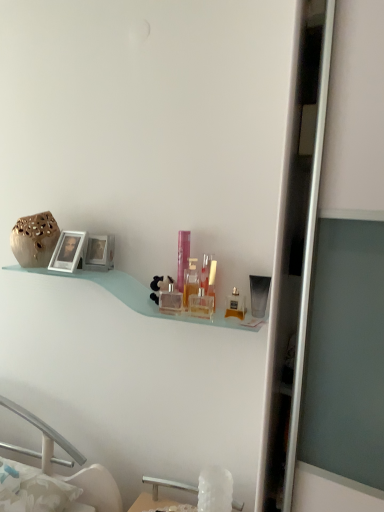
Identify the location of silver metallic picture frame at left, which is the second picture frame from right to left. Image resolution: width=384 pixels, height=512 pixels. (68, 251).

What is the approximate height of white glossy table at lower center?

It is 2.82 inches.

Locate an element on the screen. The width and height of the screenshot is (384, 512). silver metallic picture frame at left, which is the second picture frame from right to left is located at coordinates (68, 251).

From a real-world perspective, is white fabric pillow at lower left positioned under pink glass perfume bottle at center, which appears as the 2th toiletry when viewed from the left, based on gravity?

Yes, from a real-world perspective, white fabric pillow at lower left is under pink glass perfume bottle at center, which appears as the 2th toiletry when viewed from the left.

Does white fabric pillow at lower left have a lesser width compared to pink glass perfume bottle at center, marked as the 7th toiletry in a right-to-left arrangement?

No.

Where is `pillow below the pink glass perfume bottle at center, marked as the 7th toiletry in a right-to-left arrangement (from a real-world perspective)`? The height and width of the screenshot is (512, 384). pillow below the pink glass perfume bottle at center, marked as the 7th toiletry in a right-to-left arrangement (from a real-world perspective) is located at coordinates (34, 490).

Which object is positioned more to the right, white fabric pillow at lower left or pink glass perfume bottle at center, which appears as the 2th toiletry when viewed from the left?

Positioned to the right is pink glass perfume bottle at center, which appears as the 2th toiletry when viewed from the left.

From a real-world perspective, which object stands above the other?

metallic silver picture frame at upper left, the first picture frame from the right.

Which is in front, point (207, 304) or point (97, 239)?

The point (207, 304) is in front.

Which object is further away from the camera, clear glass perfume bottle at center, the fourth toiletry in the left-to-right sequence, or metallic silver picture frame at upper left, which is the 2th picture frame from left to right?

Positioned behind is metallic silver picture frame at upper left, which is the 2th picture frame from left to right.

Based on the photo, from a real-world perspective, relative to pink glass perfume bottle at center, which appears as the 2th toiletry when viewed from the left, is white crystal sink at lower center vertically above or below?

white crystal sink at lower center is below pink glass perfume bottle at center, which appears as the 2th toiletry when viewed from the left.

Is point (243, 505) less distant than point (185, 248)?

No, (243, 505) is behind (185, 248).

Between white crystal sink at lower center and pink glass perfume bottle at center, marked as the 7th toiletry in a right-to-left arrangement, which one has more height?

With more height is pink glass perfume bottle at center, marked as the 7th toiletry in a right-to-left arrangement.

Which object is positioned more to the left, matte gold perfume at center, which appears as the 2th toiletry when viewed from the right, or pink glass perfume bottle at center, marked as the 7th toiletry in a right-to-left arrangement?

Positioned to the left is pink glass perfume bottle at center, marked as the 7th toiletry in a right-to-left arrangement.

From a real-world perspective, is matte gold perfume at center, which appears as the 2th toiletry when viewed from the right, physically above pink glass perfume bottle at center, marked as the 7th toiletry in a right-to-left arrangement?

No, from a real-world perspective, matte gold perfume at center, which appears as the 2th toiletry when viewed from the right, is not above pink glass perfume bottle at center, marked as the 7th toiletry in a right-to-left arrangement.

Do you think matte gold perfume at center, which appears as the 2th toiletry when viewed from the right, is within pink glass perfume bottle at center, marked as the 7th toiletry in a right-to-left arrangement, or outside of it?

matte gold perfume at center, which appears as the 2th toiletry when viewed from the right, is not inside pink glass perfume bottle at center, marked as the 7th toiletry in a right-to-left arrangement, it's outside.

Could you measure the distance between matte gold perfume at center, placed as the 7th toiletry when sorted from left to right, and pink glass perfume bottle at center, marked as the 7th toiletry in a right-to-left arrangement?

matte gold perfume at center, placed as the 7th toiletry when sorted from left to right, is 8.44 inches away from pink glass perfume bottle at center, marked as the 7th toiletry in a right-to-left arrangement.

Can you confirm if metallic silver picture frame at upper left, the first picture frame from the right, is shorter than clear plastic bottle at center, the 4th toiletry when ordered from right to left?

Correct, metallic silver picture frame at upper left, the first picture frame from the right, is not as tall as clear plastic bottle at center, the 4th toiletry when ordered from right to left.

Considering the positions of points (104, 259) and (210, 258), is point (104, 259) farther from camera compared to point (210, 258)?

That is True.

Find the location of a particular element. The width and height of the screenshot is (384, 512). the 2nd picture frame behind the clear plastic bottle at center, the 5th toiletry from the left is located at coordinates (99, 253).

Based on the photo, does translucent glass perfume bottle at center, the 3th toiletry in the left-to-right sequence, appear on the left side of white fabric pillow at lower left?

No.

Considering the sizes of translucent glass perfume bottle at center, which is the 6th toiletry from right to left, and white fabric pillow at lower left in the image, is translucent glass perfume bottle at center, which is the 6th toiletry from right to left, taller or shorter than white fabric pillow at lower left?

Considering their sizes, translucent glass perfume bottle at center, which is the 6th toiletry from right to left, has more height than white fabric pillow at lower left.

Does translucent glass perfume bottle at center, the 3th toiletry in the left-to-right sequence, have a smaller size compared to white fabric pillow at lower left?

Correct, translucent glass perfume bottle at center, the 3th toiletry in the left-to-right sequence, occupies less space than white fabric pillow at lower left.

How many degrees apart are the facing directions of white crystal sink at lower center and silver metallic picture frame at left, acting as the first picture frame starting from the left?

white crystal sink at lower center and silver metallic picture frame at left, acting as the first picture frame starting from the left, are facing 1.32 degrees away from each other.

From the picture: Which object is closer to the camera, white crystal sink at lower center or silver metallic picture frame at left, acting as the first picture frame starting from the left?

white crystal sink at lower center is in front.

Can you confirm if white crystal sink at lower center is positioned to the left of silver metallic picture frame at left, which is the second picture frame from right to left?

No, white crystal sink at lower center is not to the left of silver metallic picture frame at left, which is the second picture frame from right to left.

From a real-world perspective, is white crystal sink at lower center physically above silver metallic picture frame at left, which is the second picture frame from right to left?

No, from a real-world perspective, white crystal sink at lower center is not on top of silver metallic picture frame at left, which is the second picture frame from right to left.

This screenshot has height=512, width=384. Find the location of `toiletry that is the 8th one when counting upward from the white fabric pillow at lower left (from the image's perspective)`. toiletry that is the 8th one when counting upward from the white fabric pillow at lower left (from the image's perspective) is located at coordinates (182, 257).

Identify the location of the 2nd picture frame behind the clear glass perfume bottle at center, the fourth toiletry in the left-to-right sequence. click(x=99, y=253).

Consider the image. Which object lies further to the anchor point silver metallic picture frame at left, acting as the first picture frame starting from the left, white glossy table at lower center or pink glass perfume bottle at center, marked as the 7th toiletry in a right-to-left arrangement?

Based on the image, white glossy table at lower center appears to be further to silver metallic picture frame at left, acting as the first picture frame starting from the left.

Looking at the image, which one is located closer to satin black tube at upper right, arranged as the eighth toiletry when viewed from the left, clear plastic bottle at center, the 4th toiletry when ordered from right to left, or white glossy table at lower center?

clear plastic bottle at center, the 4th toiletry when ordered from right to left, is closer to satin black tube at upper right, arranged as the eighth toiletry when viewed from the left.

Looking at the image, which one is located further to white crystal sink at lower center, white glossy table at lower center or clear plastic bottle at center, the 4th toiletry when ordered from right to left?

Among the two, clear plastic bottle at center, the 4th toiletry when ordered from right to left, is located further to white crystal sink at lower center.

Estimate the real-world distances between objects in this image. Which object is further from clear glass perfume bottle at center, the fourth toiletry in the left-to-right sequence, translucent glass perfume bottle at center, which is the 6th toiletry from right to left, or white glossy table at lower center?

The object further to clear glass perfume bottle at center, the fourth toiletry in the left-to-right sequence, is white glossy table at lower center.

Estimate the real-world distances between objects in this image. Which object is further from metallic silver picture frame at upper left, which is the 2th picture frame from left to right, satin black tube at upper right, arranged as the eighth toiletry when viewed from the left, or clear plastic bottle at center, the 4th toiletry when ordered from right to left?

satin black tube at upper right, arranged as the eighth toiletry when viewed from the left, is positioned further to the anchor metallic silver picture frame at upper left, which is the 2th picture frame from left to right.

When comparing their distances from white crystal sink at lower center, does clear glass perfume bottle at center, positioned as the fifth toiletry in right-to-left order, or pink glass perfume bottle at center, marked as the 7th toiletry in a right-to-left arrangement, seem further?

Among the two, pink glass perfume bottle at center, marked as the 7th toiletry in a right-to-left arrangement, is located further to white crystal sink at lower center.

When comparing their distances from satin black tube at upper right, arranged as the eighth toiletry when viewed from the left, does clear glass perfume bottle at center, which is the 1th toiletry from left to right, or white crystal sink at lower center seem closer?

Among the two, clear glass perfume bottle at center, which is the 1th toiletry from left to right, is located nearer to satin black tube at upper right, arranged as the eighth toiletry when viewed from the left.

Which object lies further to the anchor point white fabric pillow at lower left, translucent glass perfume bottle at center, which is the 6th toiletry from right to left, or clear plastic bottle at center, the 4th toiletry when ordered from right to left?

Among the two, clear plastic bottle at center, the 4th toiletry when ordered from right to left, is located further to white fabric pillow at lower left.

Locate an element on the screen. The image size is (384, 512). sink that lies between satin black tube at upper right, arranged as the eighth toiletry when viewed from the left, and white glossy table at lower center from top to bottom is located at coordinates (168, 485).

Locate an element on the screen. The width and height of the screenshot is (384, 512). sink that lies between silver metallic picture frame at left, which is the second picture frame from right to left, and white glossy table at lower center from top to bottom is located at coordinates (168, 485).

Locate an element on the screen. The height and width of the screenshot is (512, 384). picture frame between silver metallic picture frame at left, acting as the first picture frame starting from the left, and matte gold perfume at center, placed as the 7th toiletry when sorted from left to right, in the horizontal direction is located at coordinates (99, 253).

What are the coordinates of `picture frame between silver metallic picture frame at left, which is the second picture frame from right to left, and pink glass perfume bottle at center, marked as the 7th toiletry in a right-to-left arrangement` in the screenshot? It's located at (99, 253).